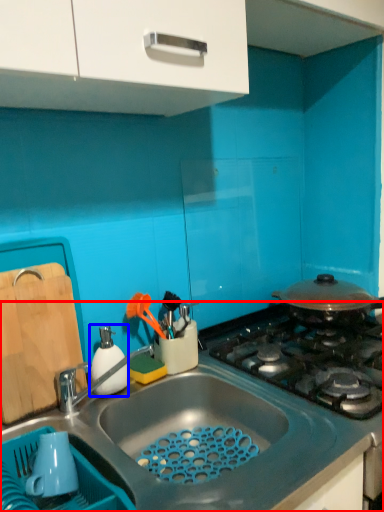
Question: Which object is further to the camera taking this photo, countertop (highlighted by a red box) or appliance (highlighted by a blue box)?

Choices:
 (A) countertop
 (B) appliance

Answer: (B)